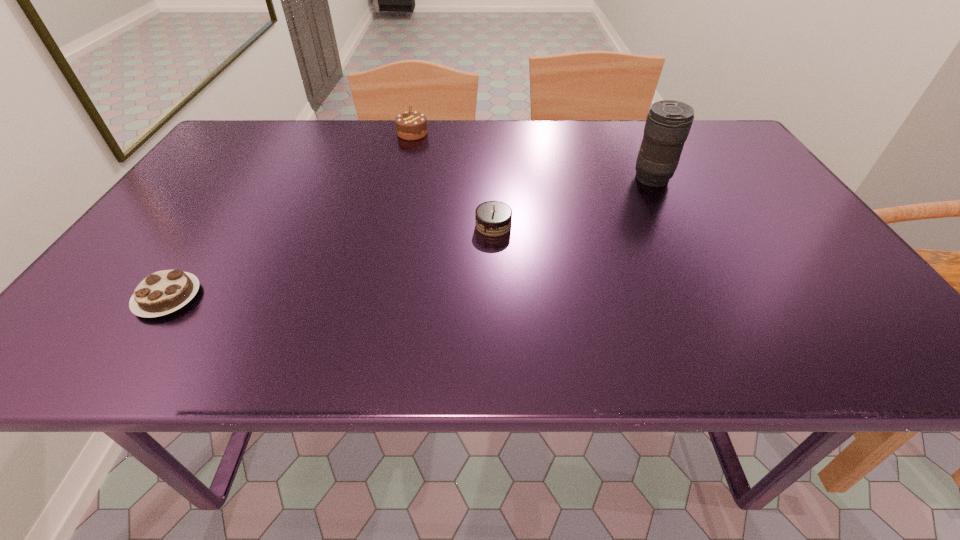
At what (x,y) coordinates should I click in order to perform the action: click on the tallest object. Please return your answer as a coordinate pair (x, y). Looking at the image, I should click on [x=668, y=123].

In order to click on telephoto lens in this screenshot , I will do [668, 123].

Image resolution: width=960 pixels, height=540 pixels. Identify the location of the second object from left to right. (410, 125).

At what (x,y) coordinates should I click in order to perform the action: click on the farthest chocolate cake. Please return your answer as a coordinate pair (x, y). The image size is (960, 540). Looking at the image, I should click on (410, 125).

Find the location of a particular element. This screenshot has width=960, height=540. the second nearest object is located at coordinates (492, 218).

Where is `the second object from right to left`? This screenshot has width=960, height=540. the second object from right to left is located at coordinates (492, 218).

The image size is (960, 540). I want to click on the nearest chocolate cake, so point(163,292).

The width and height of the screenshot is (960, 540). Identify the location of the shortest object. (163, 292).

The width and height of the screenshot is (960, 540). What are the coordinates of `free point located on the side of the telephoto lens where the control switches are located` in the screenshot? It's located at (511, 179).

The image size is (960, 540). What are the coordinates of `free space located on the side of the telephoto lens where the control switches are located` in the screenshot? It's located at (545, 179).